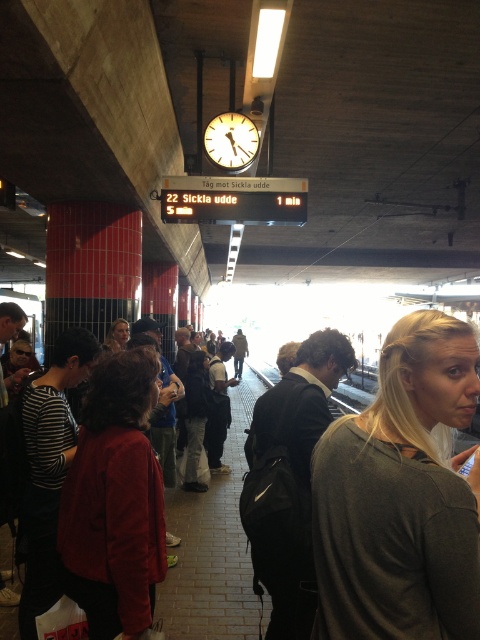
You are standing on the train station platform and see the gray matte shirt at center. If you want to move closer to it, which direction should you walk?

Since the gray matte shirt at center is located at point 0.777 on the x axis and 0.835 on the y axis, you should walk towards the center of the platform to reach it.

You are a passenger waiting on the train platform and see two people in front of you. One is wearing a gray matte shirt at center and the other is wearing a velvet red jacket at center. Which person is shorter?

The gray matte shirt at center is shorter than the velvet red jacket at center because the gray matte shirt at center is not as tall as the velvet red jacket at center.

You are standing on the train station platform and see a person wearing a gray matte shirt at center. If you want to hand them a train ticket, can you reach them without moving closer?

The gray matte shirt at center and viewer are 1.26 meters apart, so you can reach them without moving closer since the typical reaching distance for an average person is about 1 meter.